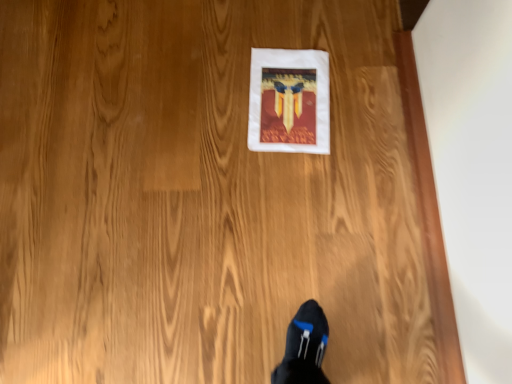
This screenshot has width=512, height=384. Describe the element at coordinates (289, 101) in the screenshot. I see `matte paper comic book at center` at that location.

In order to face matte paper comic book at center, should I rotate leftwards or rightwards?

To align with it, rotate right about 4.811°.

Locate an element on the screen. matte paper comic book at center is located at coordinates (289, 101).

This screenshot has height=384, width=512. Find the location of `matte paper comic book at center`. matte paper comic book at center is located at coordinates (289, 101).